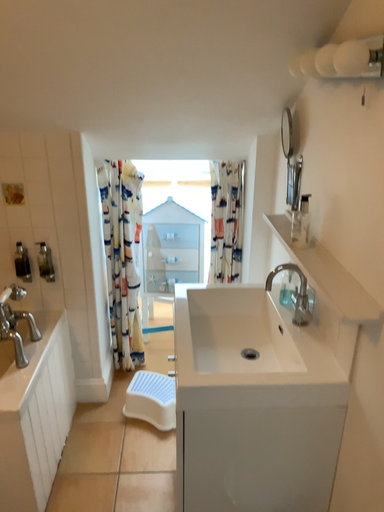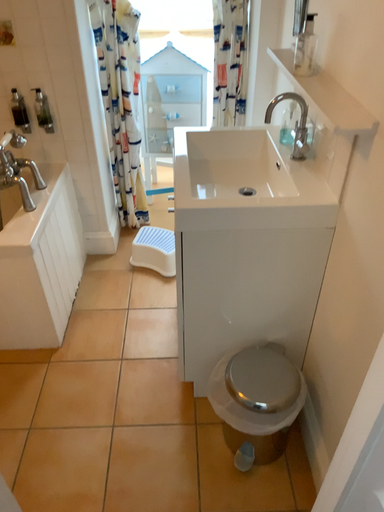
Question: Which way did the camera rotate in the video?

Choices:
 (A) rotated upward
 (B) rotated downward

Answer: (B)